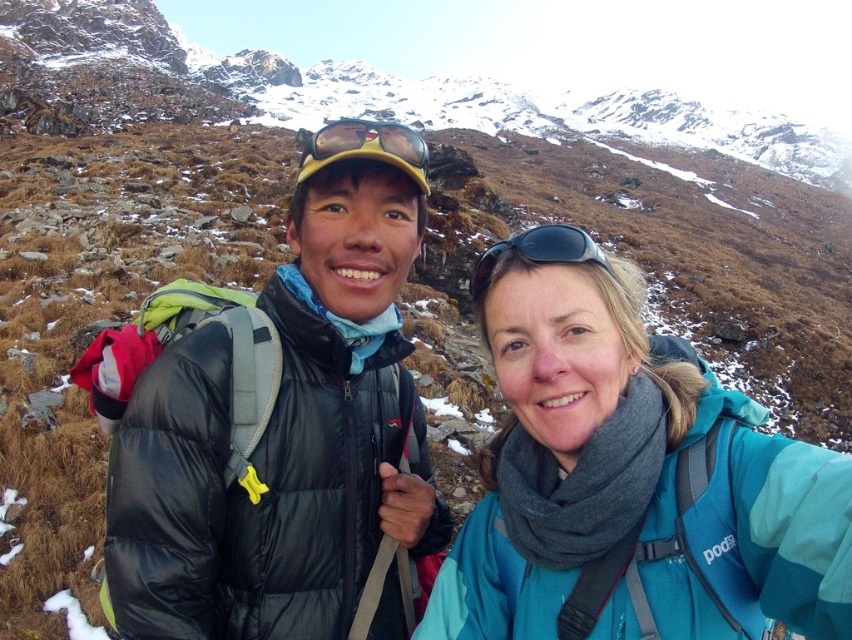
You are planning to take a photo of the two people in the mountainous region. The person with the black puffer jacket at left is standing 89.97 feet away from the other person. If your camera has a maximum focus range of 100 feet, can you capture both individuals clearly in one shot?

Yes, since the distance between the black puffer jacket at left and the other person is 89.97 feet, which is within the camera maximum focus range of 100 feet, so both can be captured clearly in one shot.

You are a photographer trying to capture a photo of the black puffer jacket at left and the black plastic sunglasses at center. Which object should you focus on first if you want to start from the left side of the frame?

The black puffer jacket at left should be focused on first since it is positioned to the left of the black plastic sunglasses at center.

You are a photographer trying to capture both the black puffer jacket at left and the black puffer jacket at center in a single frame. Based on their positions, which jacket should you position closer to the left side of your camera viewfinder to ensure both are fully visible?

You should position the black puffer jacket at center closer to the left side of your camera viewfinder because the black puffer jacket at left is to the right of the black puffer jacket at center. This arrangement ensures both jackets are within the frame without overlapping excessively.